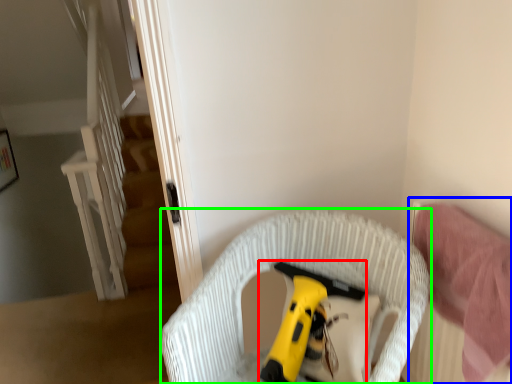
Question: Which is nearer to the toy (highlighted by a red box)? bed (highlighted by a blue box) or furniture (highlighted by a green box).

Choices:
 (A) bed
 (B) furniture

Answer: (B)